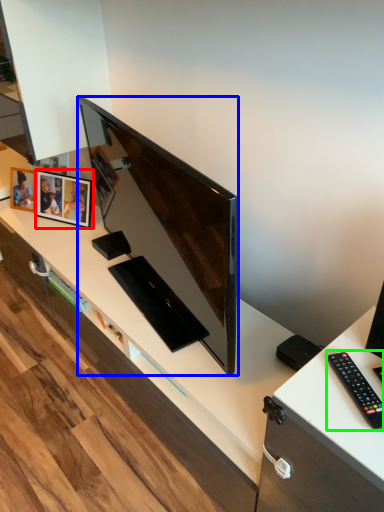
Question: Considering the real-world distances, which object is farthest from picture frame (highlighted by a red box)? television (highlighted by a blue box) or remote control (highlighted by a green box)?

Choices:
 (A) television
 (B) remote control

Answer: (B)